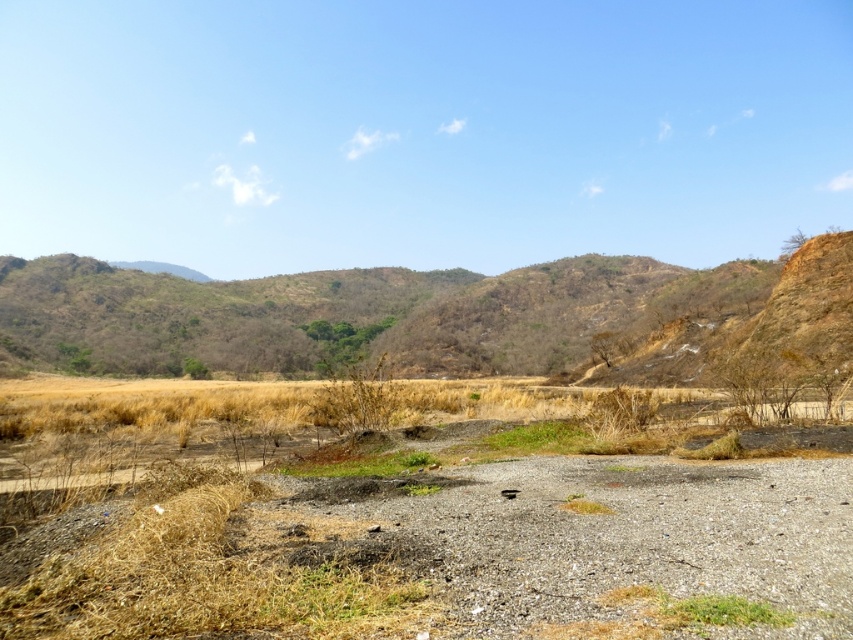
Question: Does brown gravel dirt track at center appear on the right side of green grass at lower center?

Choices:
 (A) no
 (B) yes

Answer: (A)

Question: Estimate the real-world distances between objects in this image. Which object is farther from the brown gravel dirt track at center?

Choices:
 (A) brown/dry grassy hill at center
 (B) green grass at lower center

Answer: (A)

Question: Observing the image, what is the correct spatial positioning of brown/dry grassy hill at center in reference to green grass at lower center?

Choices:
 (A) left
 (B) right

Answer: (A)

Question: Which point is closer to the camera?

Choices:
 (A) brown/dry grassy hill at center
 (B) brown gravel dirt track at center

Answer: (B)

Question: Does brown gravel dirt track at center appear on the right side of brown/dry grassy hill at center?

Choices:
 (A) no
 (B) yes

Answer: (B)

Question: Which object is positioned farthest from the green grass at lower center?

Choices:
 (A) brown/dry grassy hill at center
 (B) brown gravel dirt track at center

Answer: (A)